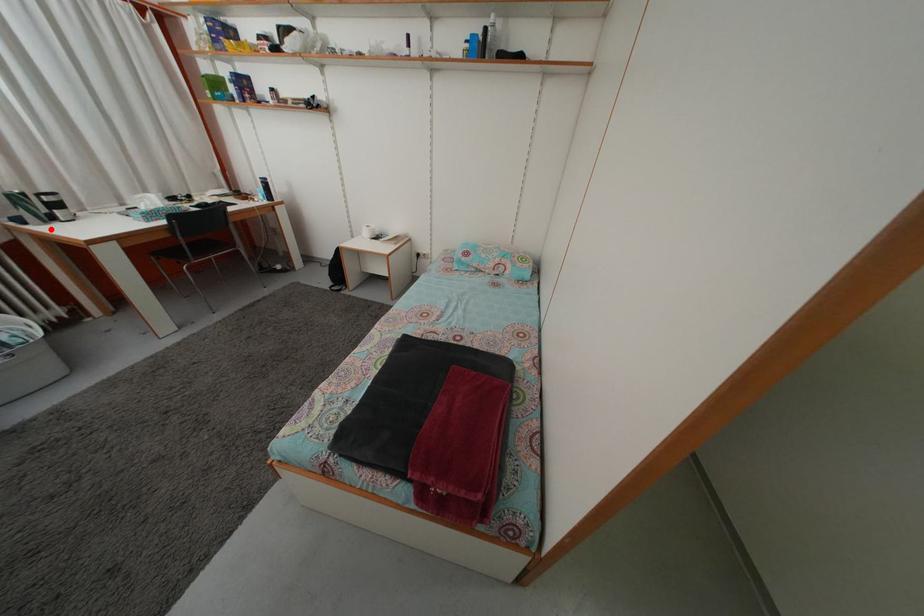
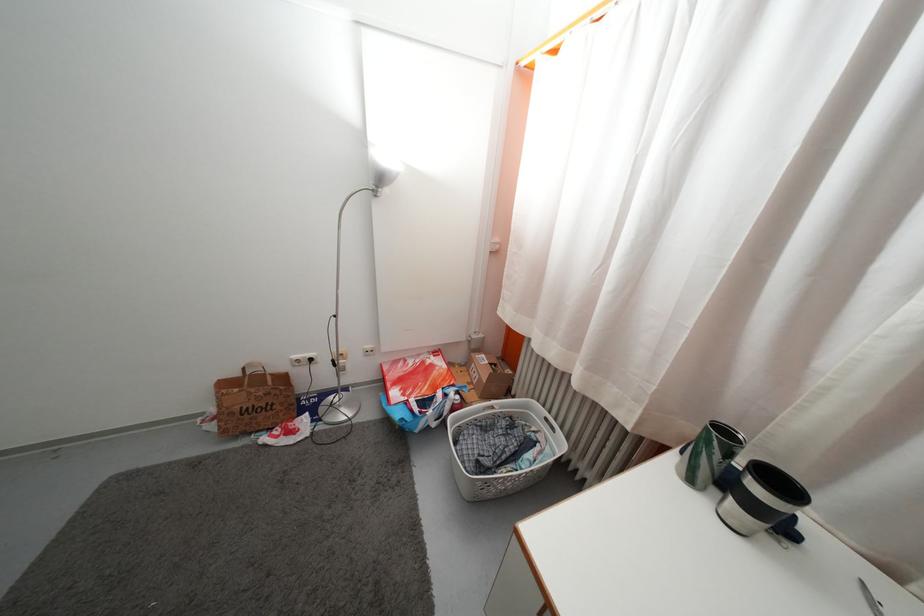
Where in the second image is the point corresponding to the highlighted location from the first image?

(697, 488)